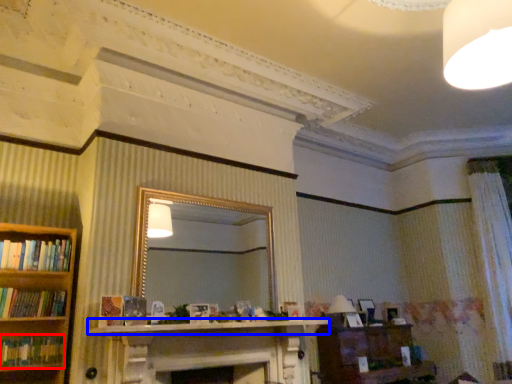
Question: Which object appears farthest to the camera in this image, book (highlighted by a red box) or mantle (highlighted by a blue box)?

Choices:
 (A) book
 (B) mantle

Answer: (A)